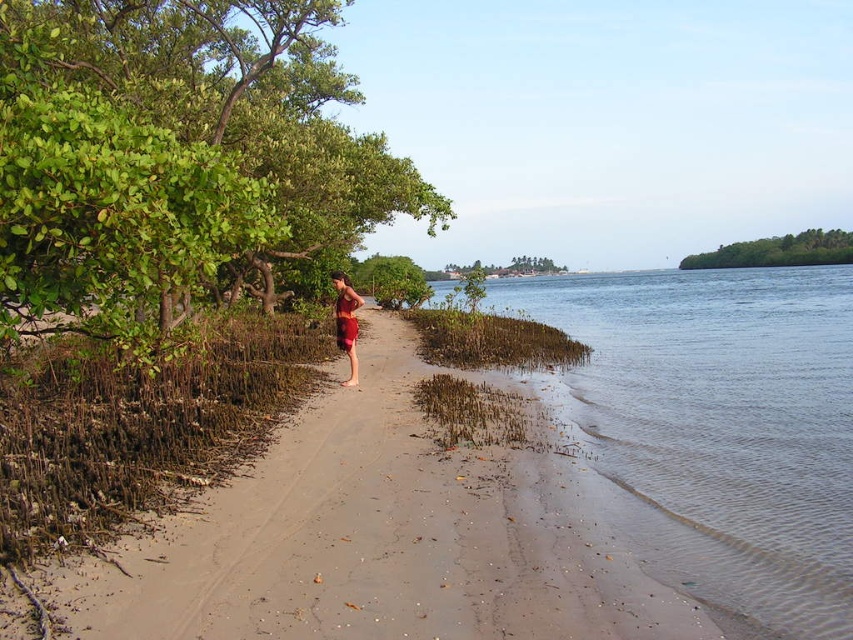
Question: Can you confirm if matte red skirt at center is positioned below green leafy tree at center?

Choices:
 (A) yes
 (B) no

Answer: (A)

Question: Estimate the real-world distances between objects in this image. Which object is closer to the clear water at lower right?

Choices:
 (A) sandy beach at center
 (B) matte red skirt at center

Answer: (A)

Question: In this image, where is clear water at lower right located relative to green leafy tree at center?

Choices:
 (A) below
 (B) above

Answer: (A)

Question: Which point is closer to the camera?

Choices:
 (A) sandy beach at center
 (B) clear water at lower right
 (C) matte red skirt at center

Answer: (A)

Question: Is clear water at lower right bigger than matte red skirt at center?

Choices:
 (A) no
 (B) yes

Answer: (B)

Question: Which point is farther to the camera?

Choices:
 (A) (166, 292)
 (B) (833, 442)
 (C) (357, 323)
 (D) (502, 273)

Answer: (D)